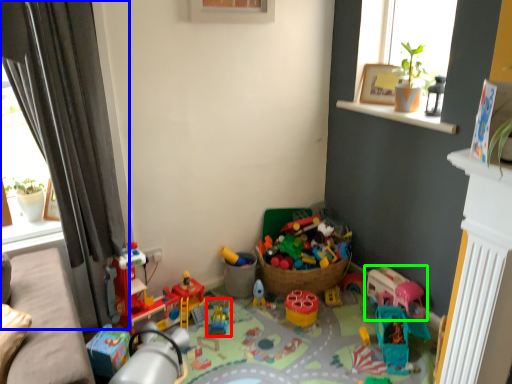
Question: Estimate the real-world distances between objects in this image. Which object is closer to toy (highlighted by a red box), curtain (highlighted by a blue box) or toy (highlighted by a green box)?

Choices:
 (A) curtain
 (B) toy

Answer: (B)